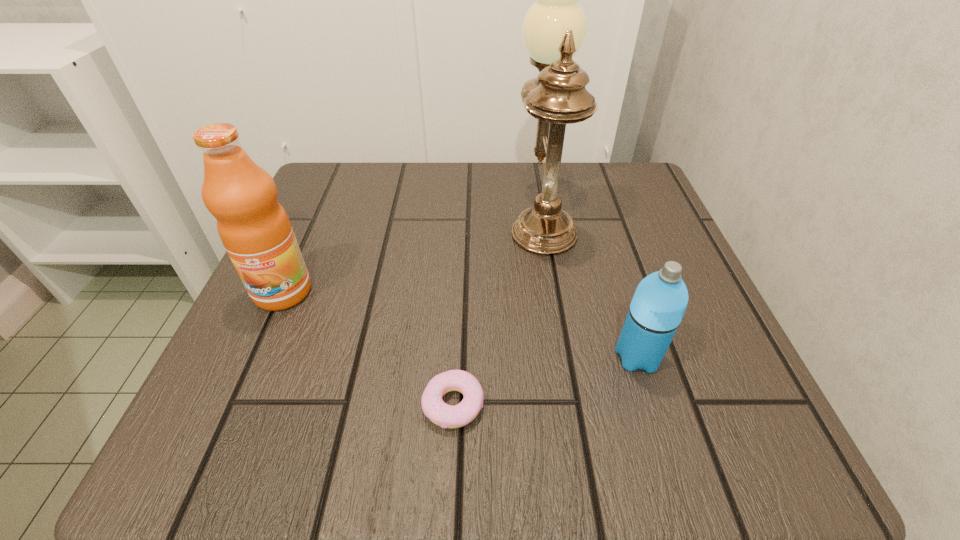
Identify the location of free space located 0.120m on the back of the thermos bottle. The height and width of the screenshot is (540, 960). (614, 283).

Find the location of a particular element. The height and width of the screenshot is (540, 960). free space located 0.380m on the back of the doughnut is located at coordinates (463, 217).

Find the location of `object at the far edge`. object at the far edge is located at coordinates (554, 29).

Identify the location of object at the near edge. (435, 409).

Locate an element on the screen. Image resolution: width=960 pixels, height=540 pixels. object that is positioned at the left edge is located at coordinates [x=253, y=226].

This screenshot has width=960, height=540. Identify the location of object at the right edge. (660, 300).

In the image, there is a desktop. What are the coordinates of `vacant space at the far edge` in the screenshot? It's located at (483, 178).

The height and width of the screenshot is (540, 960). I want to click on vacant position at the near edge of the desktop, so click(357, 452).

In the image, there is a desktop. Where is `vacant space at the left edge`? The image size is (960, 540). vacant space at the left edge is located at coordinates (308, 255).

You are a GUI agent. You are given a task and a screenshot of the screen. Output one action in this format:
    pyautogui.click(x=<x>, y=<y>)
    Task: Click on the free region at the right edge
    The image size is (960, 540).
    Given the screenshot: What is the action you would take?
    pyautogui.click(x=696, y=282)